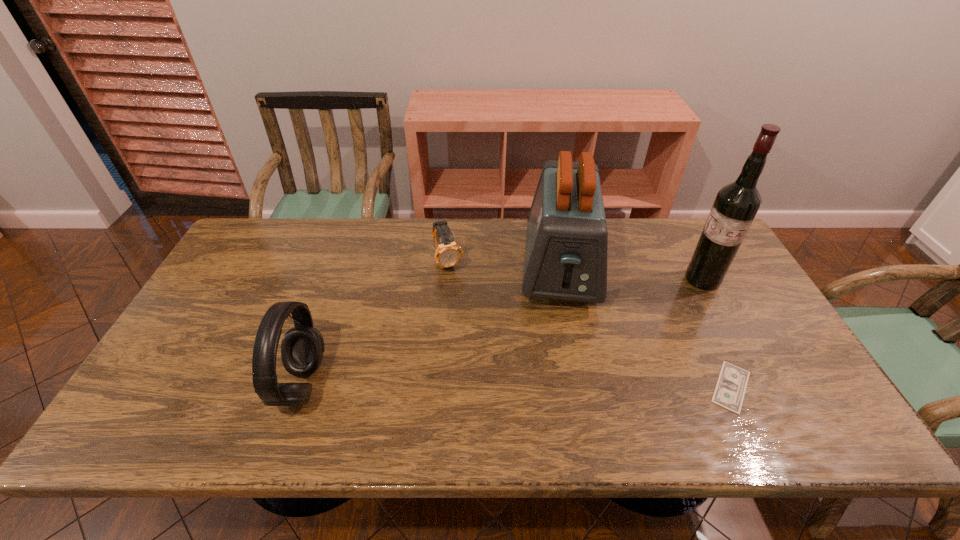
You are a GUI agent. You are given a task and a screenshot of the screen. Output one action in this format:
    pyautogui.click(x=<x>, y=<y>)
    Task: Click on the blank space located 0.310m on the face of the second object from left to right
    This screenshot has width=960, height=540.
    Given the screenshot: What is the action you would take?
    pyautogui.click(x=487, y=355)

The image size is (960, 540). Find the location of `blank space located on the face of the second object from left to right`. blank space located on the face of the second object from left to right is located at coordinates (486, 352).

Locate an element on the screen. Image resolution: width=960 pixels, height=540 pixels. free space located on the face of the second object from left to right is located at coordinates (487, 355).

Where is `free spot located on the front-facing side of the fourth shortest object`? The width and height of the screenshot is (960, 540). free spot located on the front-facing side of the fourth shortest object is located at coordinates (565, 361).

This screenshot has width=960, height=540. I want to click on free location located on the front-facing side of the fourth shortest object, so click(x=564, y=336).

At what (x,y) coordinates should I click in order to perform the action: click on free region located on the front-facing side of the fourth shortest object. Please return your answer as a coordinate pair (x, y). Image resolution: width=960 pixels, height=540 pixels. Looking at the image, I should click on (565, 348).

Locate an element on the screen. free space located 0.230m on the front and back of the tallest object is located at coordinates (645, 323).

You are a GUI agent. You are given a task and a screenshot of the screen. Output one action in this format:
    pyautogui.click(x=<x>, y=<y>)
    Task: Click on the vacant space located on the front and back of the tallest object
    Image resolution: width=960 pixels, height=540 pixels.
    Given the screenshot: What is the action you would take?
    pyautogui.click(x=627, y=338)

This screenshot has height=540, width=960. In order to click on free location located 0.250m on the front and back of the tallest object in this screenshot , I will do `click(640, 327)`.

Where is `watch located in the far edge section of the desktop`? This screenshot has width=960, height=540. watch located in the far edge section of the desktop is located at coordinates (448, 253).